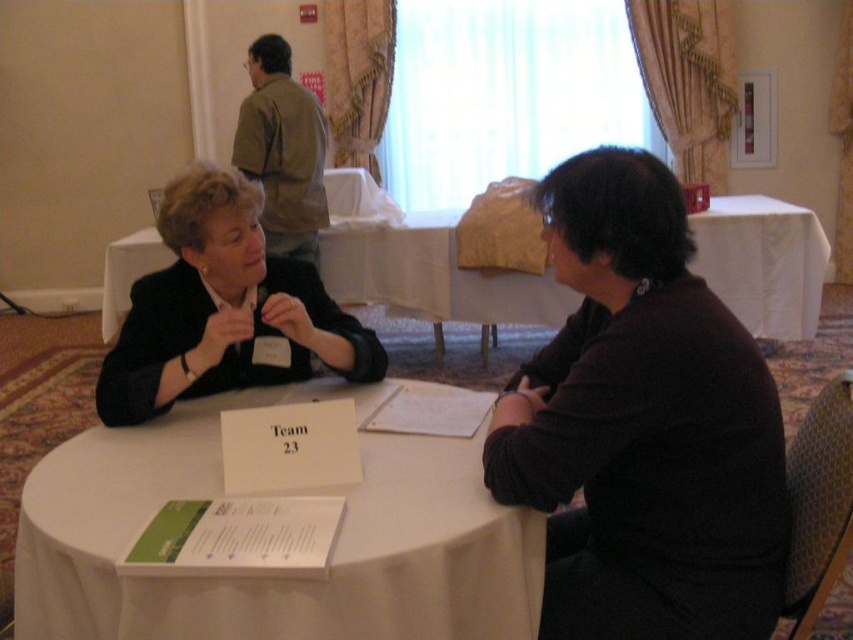
You are a photographer trying to capture a closeup of the two points in the image. The first point is at coordinate point (312,284) and the second is at point (786,216). Since you want the closest point to the camera to be in focus, which point should you focus on?

Point (312,284) is closer to the camera than point (786,216), so you should focus on point (312,284) to ensure it is in focus.

You are a photographer setting up for a live event. You need to ensure that the black matte jacket at center and the white cloth at center are both visible in your shot. Given their positions and sizes, can you frame the shot so that both objects are fully visible without any part being cut off?

The black matte jacket at center is shorter than the white cloth at center. Since the jacket is shorter, it will not obstruct the view of the cloth. Therefore, framing the shot to include the full height of the white cloth at center will automatically include the black matte jacket at center as well, ensuring both are fully visible.